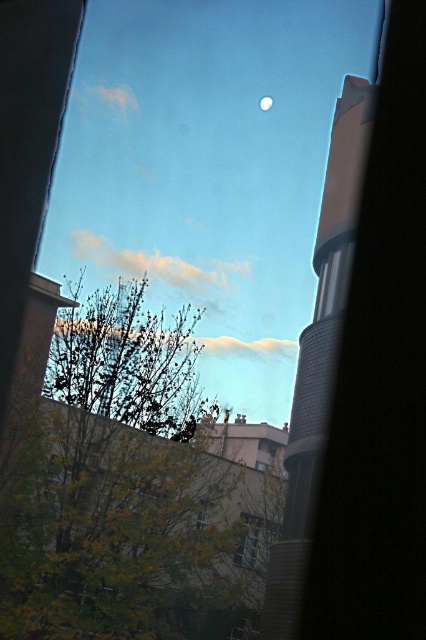
Is clear glass window at center positioned at the back of white glossy moon at upper center?

No, it is not.

Between point (204, 509) and point (265, 109), which one is positioned in front?

Point (204, 509) is more forward.

Is point (206, 502) farther from viewer compared to point (262, 106)?

That is False.

You are a GUI agent. You are given a task and a screenshot of the screen. Output one action in this format:
    pyautogui.click(x=<x>, y=<y>)
    Task: Click on the clear glass window at center
    Image resolution: width=426 pixels, height=640 pixels.
    Given the screenshot: What is the action you would take?
    pyautogui.click(x=204, y=515)

Which is above, green leafy tree at lower left or transparent glass window at center?

green leafy tree at lower left

Is point (75, 307) closer to viewer compared to point (245, 531)?

No, (75, 307) is behind (245, 531).

Measure the distance between green leafy tree at lower left and camera.

The distance of green leafy tree at lower left from camera is 1.82 meters.

The height and width of the screenshot is (640, 426). What are the coordinates of `green leafy tree at lower left` in the screenshot? It's located at (121, 481).

Between transparent glass window at center and clear glass window at center, which one appears on the right side from the viewer's perspective?

transparent glass window at center

Does point (259, 525) come in front of point (203, 508)?

That is True.

Image resolution: width=426 pixels, height=640 pixels. What are the coordinates of `transparent glass window at center` in the screenshot? It's located at (249, 541).